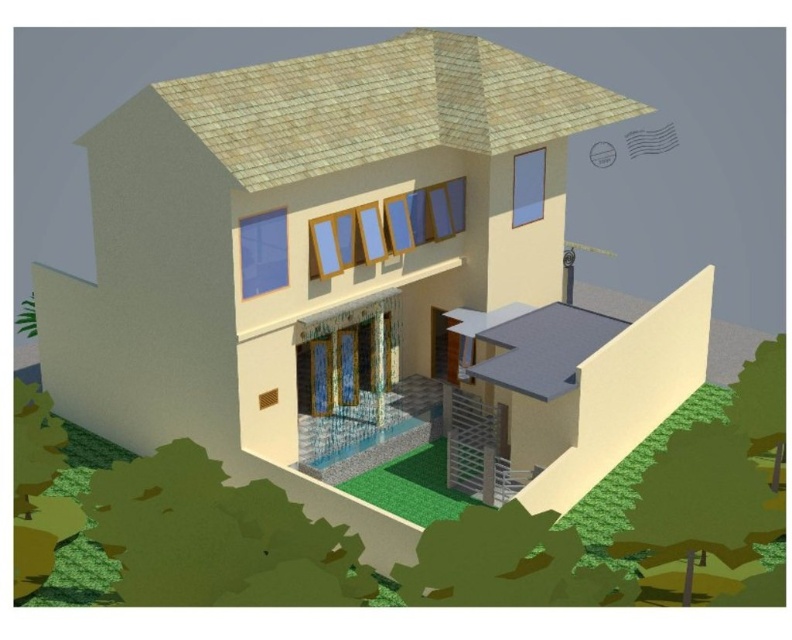
Question: Which point appears farthest from the camera in this image?

Choices:
 (A) (634, 145)
 (B) (596, 154)

Answer: (A)

Question: Is the position of matte gray mailbox at upper right more distant than that of matte gray chimney at upper right?

Choices:
 (A) no
 (B) yes

Answer: (B)

Question: Is matte gray mailbox at upper right smaller than matte gray chimney at upper right?

Choices:
 (A) yes
 (B) no

Answer: (B)

Question: Observing the image, what is the correct spatial positioning of matte gray mailbox at upper right in reference to matte gray chimney at upper right?

Choices:
 (A) below
 (B) above

Answer: (B)

Question: Which point is closer to the camera?

Choices:
 (A) (589, 157)
 (B) (642, 134)

Answer: (A)

Question: Among these objects, which one is nearest to the camera?

Choices:
 (A) matte gray mailbox at upper right
 (B) matte gray chimney at upper right

Answer: (B)